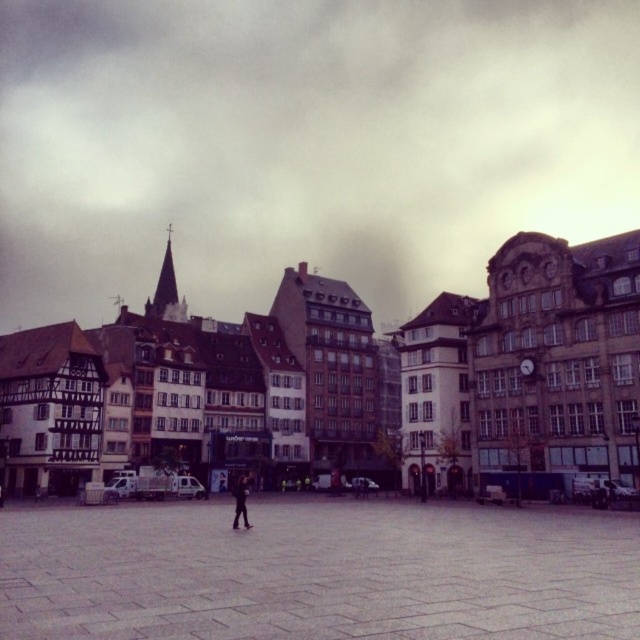
Question: Which object is farther from the camera taking this photo?

Choices:
 (A) cloudy sky at upper center
 (B) wooden timber buildings at center
 (C) dark gray fabric jacket at center
 (D) gray stone pavement at center

Answer: (A)

Question: Among these objects, which one is farthest from the camera?

Choices:
 (A) wooden timber buildings at center
 (B) cloudy sky at upper center
 (C) gray stone pavement at center
 (D) dark gray fabric jacket at center

Answer: (B)

Question: Is gray stone pavement at center behind dark gray fabric jacket at center?

Choices:
 (A) yes
 (B) no

Answer: (B)

Question: Is gray stone pavement at center behind dark gray fabric jacket at center?

Choices:
 (A) yes
 (B) no

Answer: (B)

Question: Estimate the real-world distances between objects in this image. Which object is farther from the wooden timber buildings at center?

Choices:
 (A) cloudy sky at upper center
 (B) dark gray fabric jacket at center

Answer: (A)

Question: From the image, what is the correct spatial relationship of cloudy sky at upper center in relation to dark gray fabric jacket at center?

Choices:
 (A) left
 (B) right

Answer: (B)